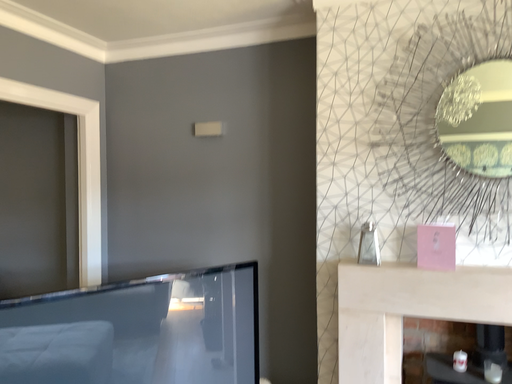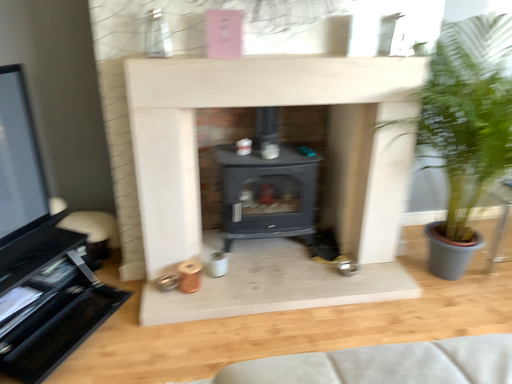
Question: Which way did the camera rotate in the video?

Choices:
 (A) rotated left
 (B) rotated right

Answer: (B)